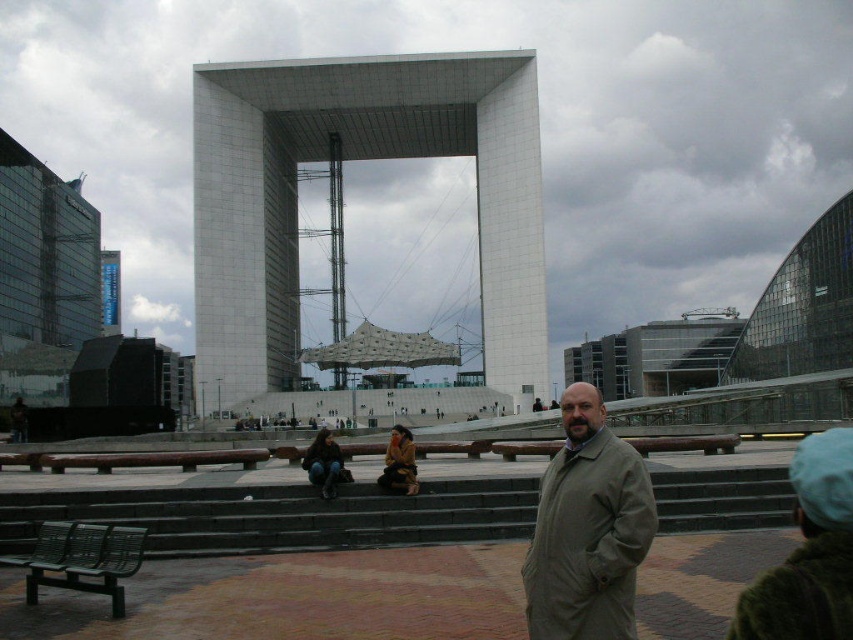
Who is taller, brown leather jacket at center or denim jacket at lower center?

With more height is brown leather jacket at center.

What do you see at coordinates (399, 464) in the screenshot? I see `brown leather jacket at center` at bounding box center [399, 464].

You are a GUI agent. You are given a task and a screenshot of the screen. Output one action in this format:
    pyautogui.click(x=<x>, y=<y>)
    Task: Click on the brown leather jacket at center
    
    Given the screenshot: What is the action you would take?
    pyautogui.click(x=399, y=464)

I want to click on brown leather jacket at center, so click(x=399, y=464).

Is point (135, 509) less distant than point (590, 465)?

No, it is behind (590, 465).

Who is more distant from viewer, (171, 534) or (573, 593)?

The point (171, 534) is more distant.

Where is `dark gray concrete stairs at center`? dark gray concrete stairs at center is located at coordinates (282, 515).

Is dark gray concrete stairs at center thinner than denim jacket at lower center?

No.

Does dark gray concrete stairs at center have a greater width compared to denim jacket at lower center?

Indeed, dark gray concrete stairs at center has a greater width compared to denim jacket at lower center.

Who is more forward, (485, 532) or (318, 465)?

Point (485, 532)

Where is `dark gray concrete stairs at center`? This screenshot has width=853, height=640. dark gray concrete stairs at center is located at coordinates (282, 515).